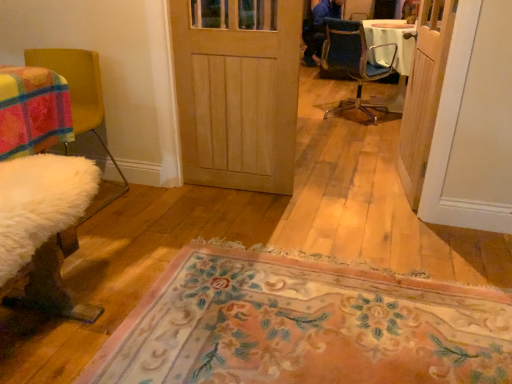
Locate an element on the screen. vacant area that is in front of natural wood door at center, positioned as the first door in left-to-right order is located at coordinates (232, 218).